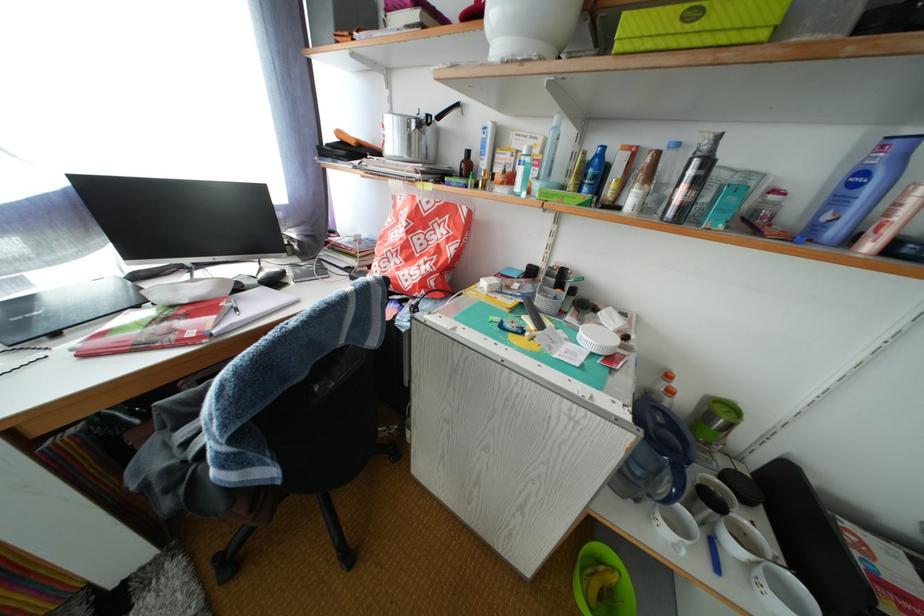
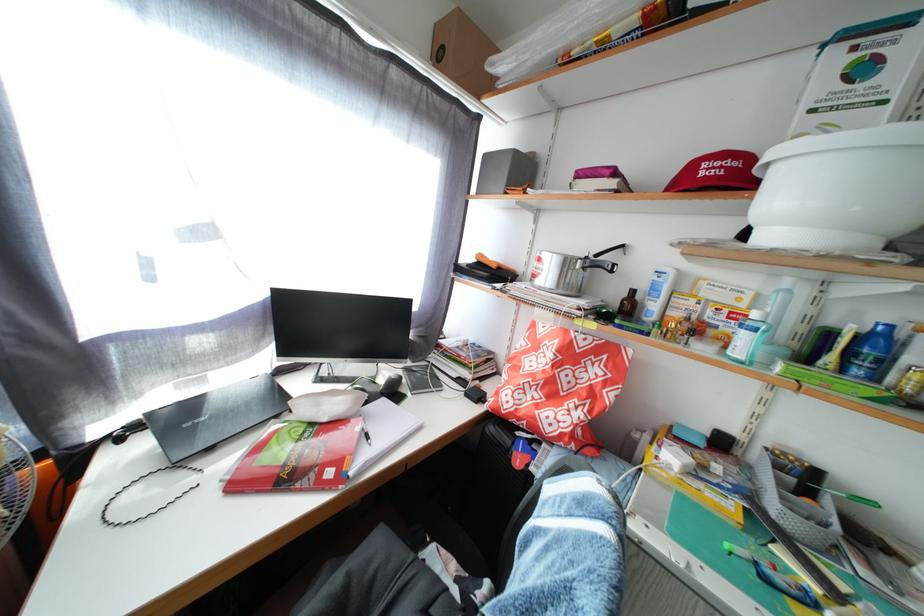
Question: Based on the continuous images, in which direction is the camera rotating? Reply with the corresponding letter.

Choices:
 (A) Left
 (B) Right
 (C) Up
 (D) Down

Answer: (C)